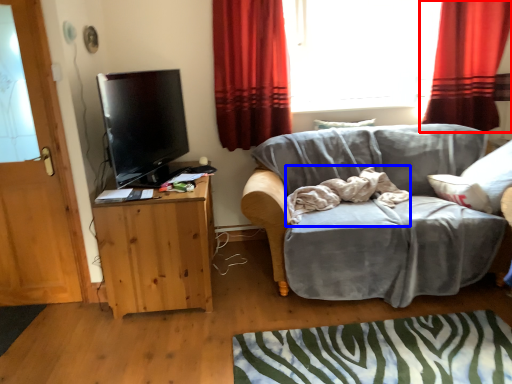
Question: Which object appears farthest to the camera in this image, curtain (highlighted by a red box) or bedding (highlighted by a blue box)?

Choices:
 (A) curtain
 (B) bedding

Answer: (A)